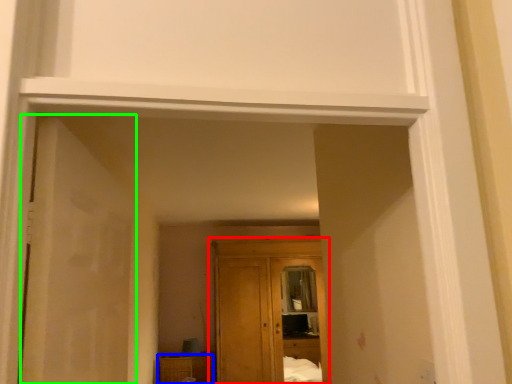
Question: Based on their relative distances, which object is farther from cupboard (highlighted by a red box)? Choose from cabinetry (highlighted by a blue box) and door (highlighted by a green box).

Choices:
 (A) cabinetry
 (B) door

Answer: (B)